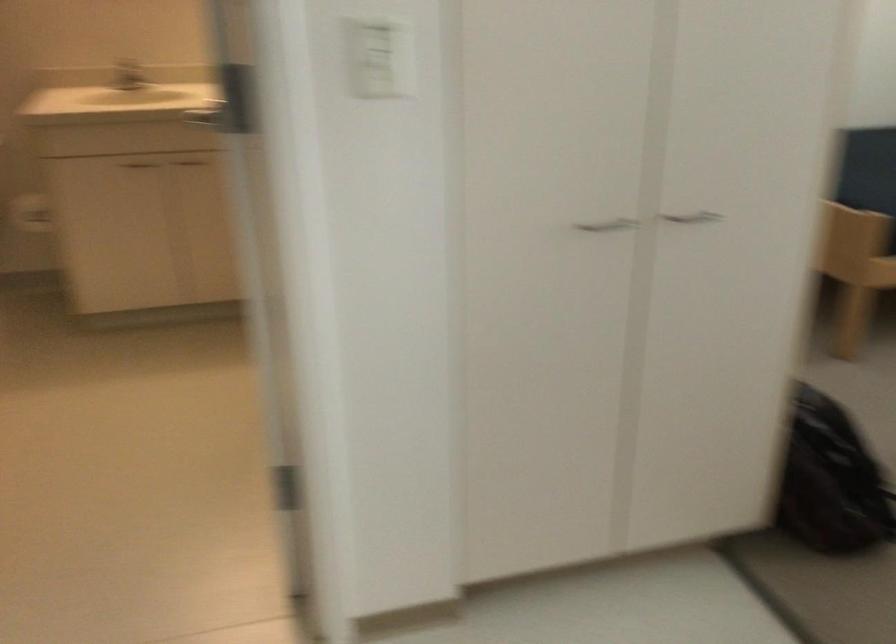
Describe the element at coordinates (831, 480) in the screenshot. I see `a black bag` at that location.